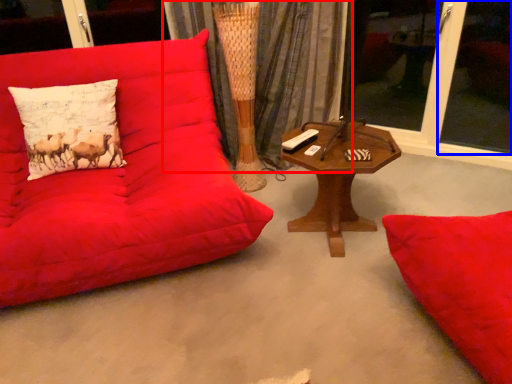
Question: Which of the following is the closest to the observer, curtain (highlighted by a red box) or window screen (highlighted by a blue box)?

Choices:
 (A) curtain
 (B) window screen

Answer: (B)